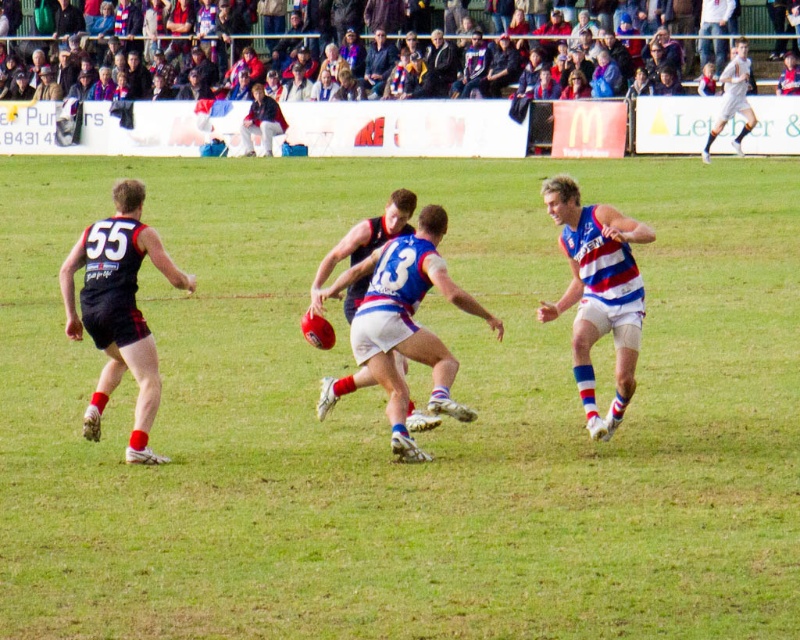
Looking at this image, you are a referee standing on the field. You need to determine if the dark blue jersey at left and the blue and white jersey at center are within the 2 meter exclusion zone during a free kick. Are they within the required distance?

The dark blue jersey at left is 1.55 meters away from the blue and white jersey at center, which is within the 2 meter exclusion zone requirement.

You are a sports analyst watching the match and need to describe the positions of the dark blue jersey at left and the light gray uniform at upper right. Which one is located more to the left side of the field?

The dark blue jersey at left is positioned on the left side of the light gray uniform at upper right, so the dark blue jersey at left is more to the left.